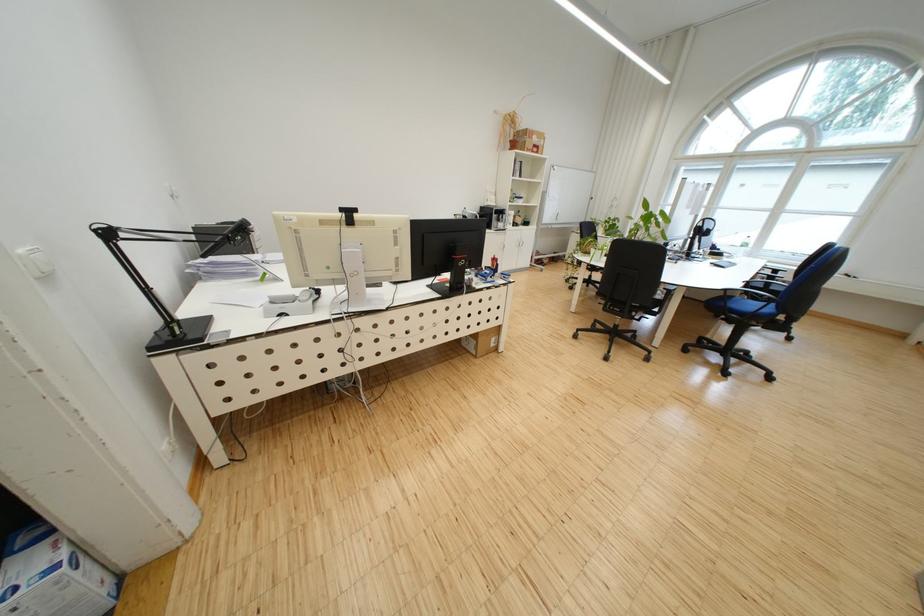
The height and width of the screenshot is (616, 924). I want to click on silver cabinet handle, so click(519, 241).